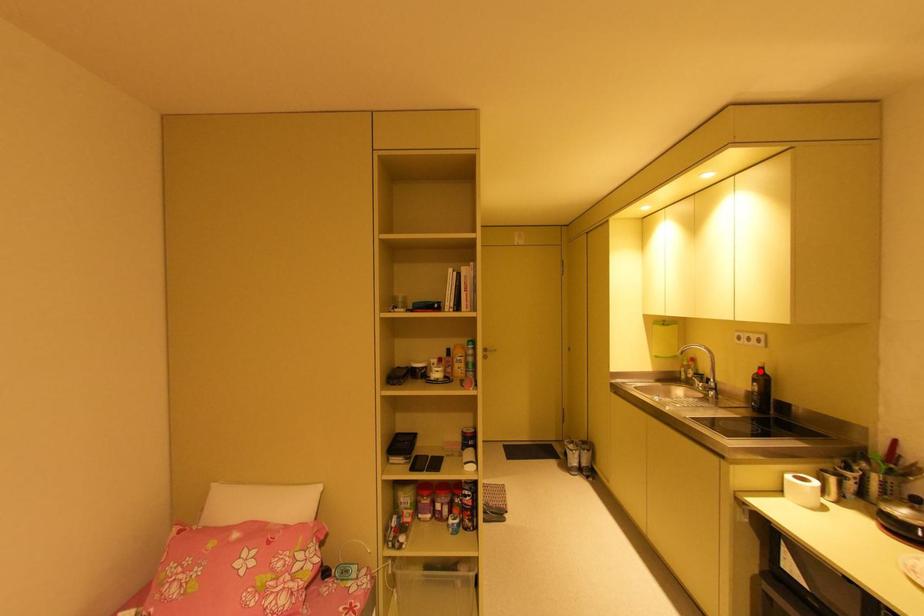
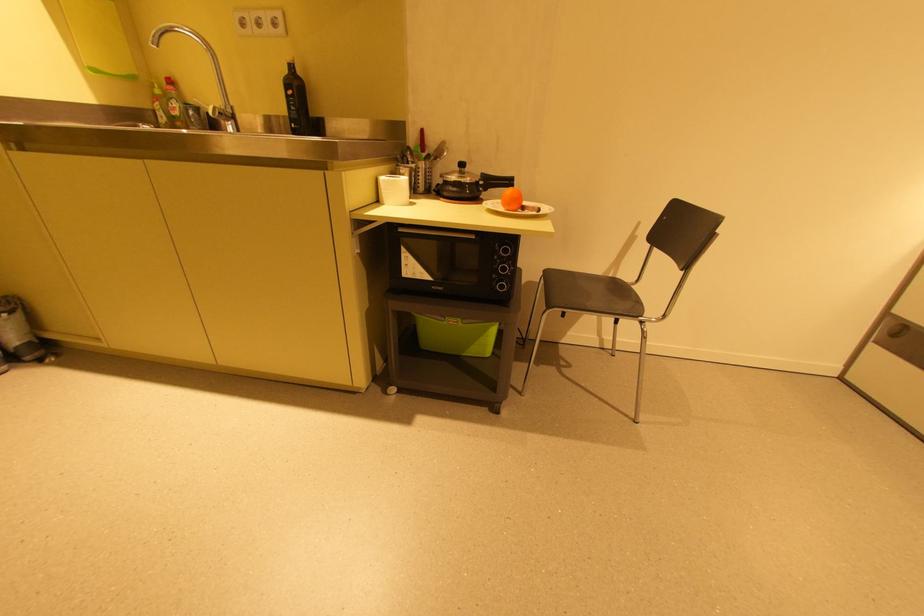
The point at the highlighted location is marked in the first image. Where is the corresponding point in the second image?

(289, 71)